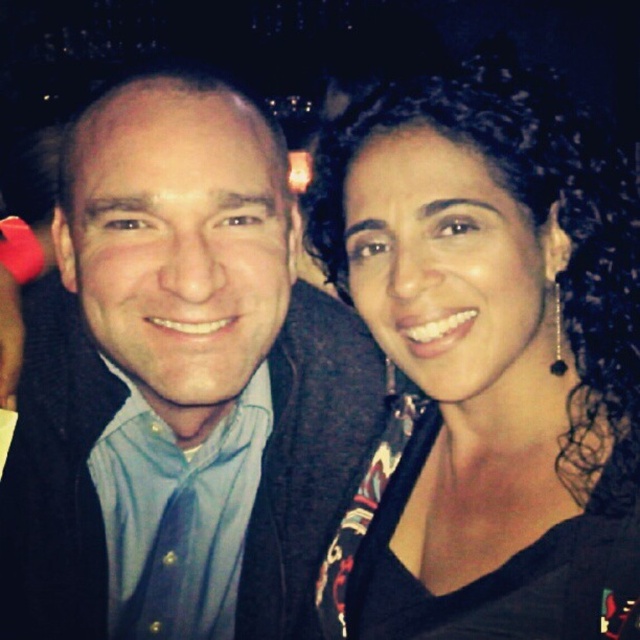
You are a photographer trying to adjust the lighting for a portrait. You notice the blue shirt at center and the black fabric at center in the scene. Which object should you focus your lighting on to ensure the darker area gets enough light?

The blue shirt at center is taller than black fabric at center. Since the black fabric at center is shorter, it might be in a shadowed area. Focus lighting on the black fabric at center to ensure it gets adequate light.

You are taking a photo of two people standing in front of you. You notice two specific points in the image labeled as point 1 at coordinates point (202, 333) and point 2 at coordinates point (572, 628). Which point is closer to your camera?

Point (202, 333) is closer to the camera than point (572, 628) because it is further to the camera than the latter according to the description.

You are a photographer trying to adjust the lighting for a photo shoot. You notice the blue shirt at center and the black fabric at center in the scene. Which object should you focus the light on to ensure it stands out more against the other?

The blue shirt at center is below black fabric at center. Since the black fabric at center is above the blue shirt, focusing the light on the blue shirt would help it stand out more against the darker background provided by the black fabric.